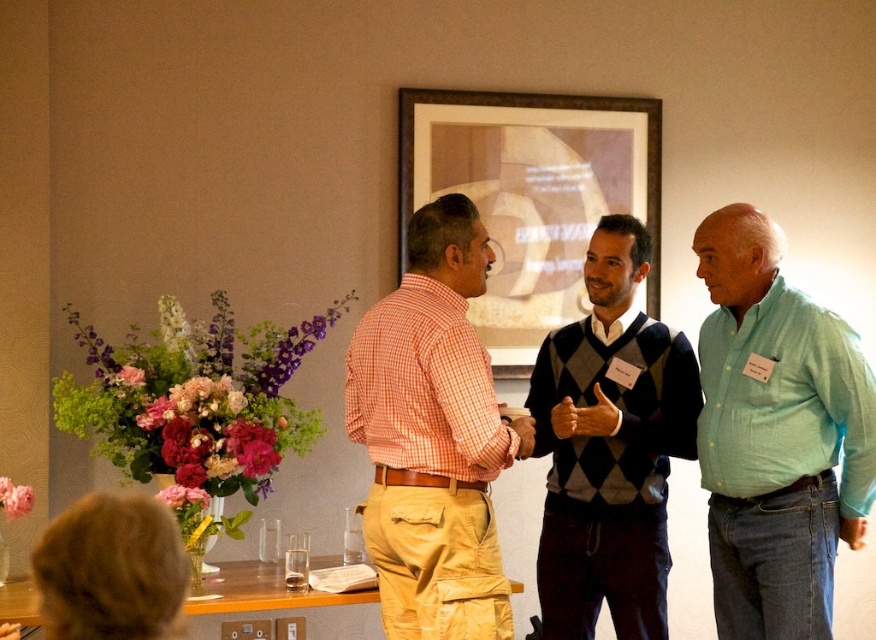
Is light blue cotton shirt at right above wooden table at lower center?

Yes, light blue cotton shirt at right is above wooden table at lower center.

Is light blue cotton shirt at right wider than wooden table at lower center?

No, light blue cotton shirt at right is not wider than wooden table at lower center.

This screenshot has height=640, width=876. Describe the element at coordinates (776, 435) in the screenshot. I see `light blue cotton shirt at right` at that location.

What are the coordinates of `light blue cotton shirt at right` in the screenshot? It's located at (776, 435).

Does light blue cotton shirt at right have a larger size compared to argyle sweater at center?

Incorrect, light blue cotton shirt at right is not larger than argyle sweater at center.

Between light blue cotton shirt at right and argyle sweater at center, which one has less height?

light blue cotton shirt at right

Measure the distance between light blue cotton shirt at right and camera.

A distance of 2.44 meters exists between light blue cotton shirt at right and camera.

You are a GUI agent. You are given a task and a screenshot of the screen. Output one action in this format:
    pyautogui.click(x=<x>, y=<y>)
    Task: Click on the light blue cotton shirt at right
    The image size is (876, 640).
    Given the screenshot: What is the action you would take?
    pyautogui.click(x=776, y=435)

Consider the image. Can you confirm if argyle sweater at center is shorter than wooden table at lower center?

No, argyle sweater at center is not shorter than wooden table at lower center.

Find the location of a particular element. This screenshot has width=876, height=640. argyle sweater at center is located at coordinates (610, 445).

Identify the location of argyle sweater at center. The image size is (876, 640). (x=610, y=445).